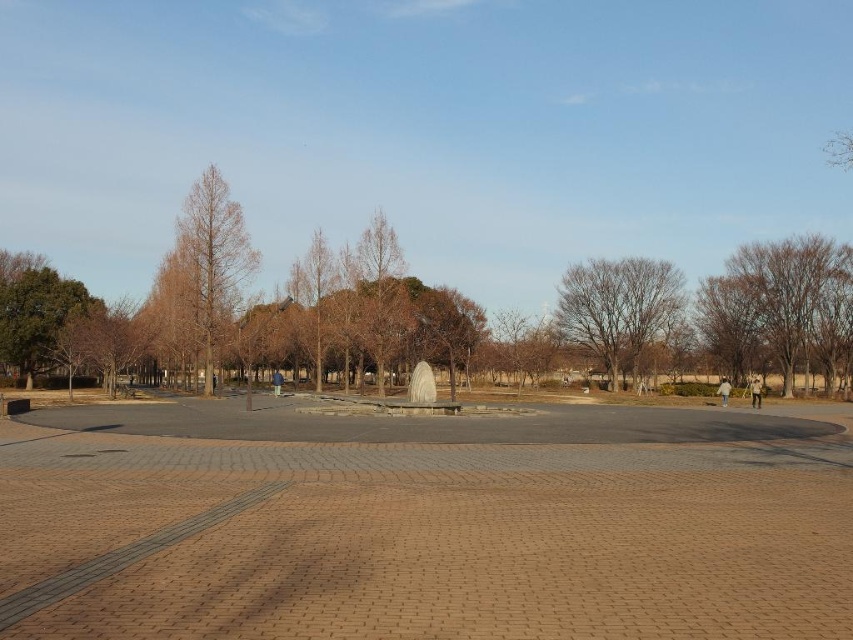
Measure the distance between brown matte tree at left and brown matte tree at center.

A distance of 42.23 feet exists between brown matte tree at left and brown matte tree at center.

Is brown matte tree at left shorter than brown matte tree at center?

In fact, brown matte tree at left may be taller than brown matte tree at center.

The image size is (853, 640). In order to click on brown matte tree at left in this screenshot , I will do `click(210, 260)`.

You are a GUI agent. You are given a task and a screenshot of the screen. Output one action in this format:
    pyautogui.click(x=<x>, y=<y>)
    Task: Click on the brown matte tree at left
    This screenshot has height=640, width=853.
    Given the screenshot: What is the action you would take?
    pyautogui.click(x=210, y=260)

Can you confirm if brown leafless tree at center is bigger than brown matte tree at left?

Actually, brown leafless tree at center might be smaller than brown matte tree at left.

Is brown leafless tree at center above brown matte tree at left?

No.

Is point (653, 300) positioned before point (225, 218)?

No, it is not.

Where is `brown leafless tree at center`? The height and width of the screenshot is (640, 853). brown leafless tree at center is located at coordinates (618, 308).

Is brown leafless tree at center to the left of brown matte tree at center from the viewer's perspective?

In fact, brown leafless tree at center is to the right of brown matte tree at center.

Can you confirm if brown leafless tree at center is thinner than brown matte tree at center?

No, brown leafless tree at center is not thinner than brown matte tree at center.

Identify the location of brown leafless tree at center. The height and width of the screenshot is (640, 853). (618, 308).